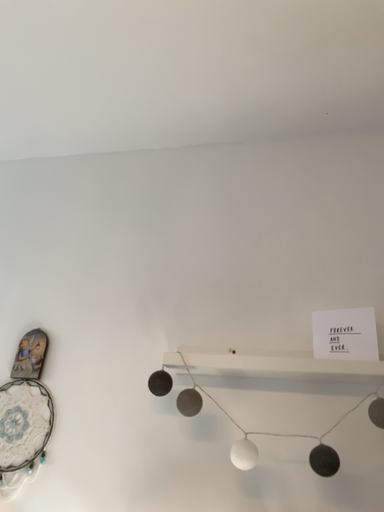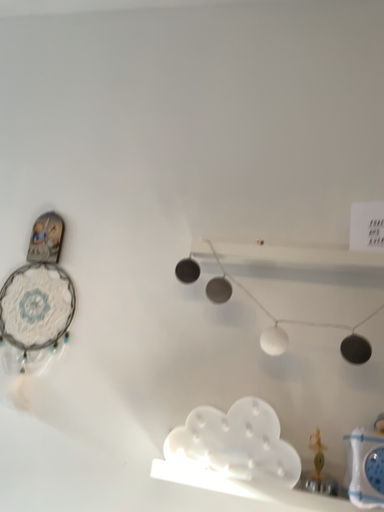
Question: How did the camera likely rotate when shooting the video?

Choices:
 (A) rotated downward
 (B) rotated upward

Answer: (A)